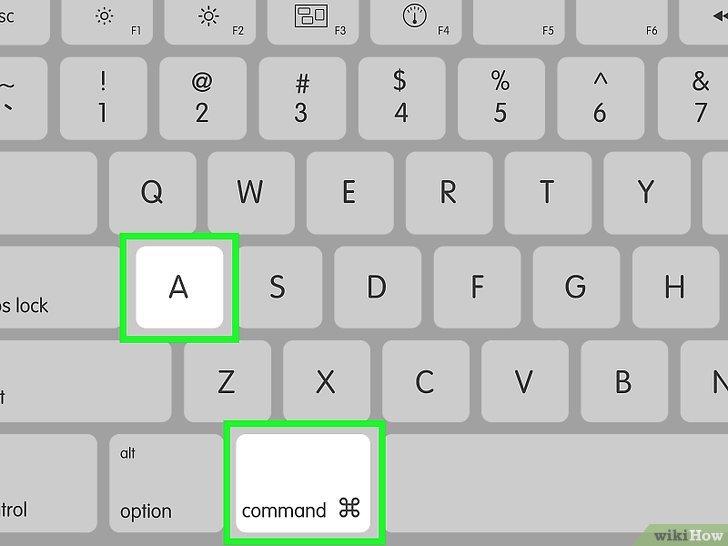
Where is `keyboard number keys`? keyboard number keys is located at coordinates (689, 100), (606, 108), (510, 97), (422, 100), (317, 100), (204, 97), (106, 102).